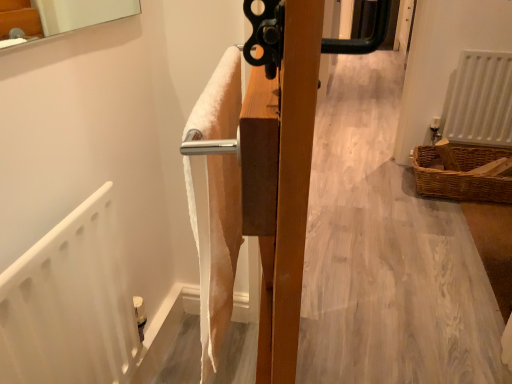
Question: Would you consider brown woven basket at lower right to be distant from white matte radiator at right?

Choices:
 (A) no
 (B) yes

Answer: (A)

Question: Can you confirm if brown woven basket at lower right is positioned to the left of white matte radiator at right?

Choices:
 (A) yes
 (B) no

Answer: (A)

Question: Considering the relative positions of brown woven basket at lower right and white matte radiator at right in the image provided, is brown woven basket at lower right behind white matte radiator at right?

Choices:
 (A) no
 (B) yes

Answer: (A)

Question: Can you confirm if brown woven basket at lower right is smaller than white matte radiator at right?

Choices:
 (A) no
 (B) yes

Answer: (A)

Question: Does brown woven basket at lower right have a lesser height compared to white matte radiator at right?

Choices:
 (A) yes
 (B) no

Answer: (A)

Question: Considering the relative positions of brown woven basket at lower right and white matte radiator at right in the image provided, is brown woven basket at lower right in front of white matte radiator at right?

Choices:
 (A) yes
 (B) no

Answer: (A)

Question: Considering the relative positions of white matte radiator at right and brown woven basket at lower right in the image provided, is white matte radiator at right to the left of brown woven basket at lower right from the viewer's perspective?

Choices:
 (A) yes
 (B) no

Answer: (B)

Question: Is white matte radiator at right to the right of brown woven basket at lower right from the viewer's perspective?

Choices:
 (A) no
 (B) yes

Answer: (B)

Question: Is the position of white matte radiator at right less distant than that of brown woven basket at lower right?

Choices:
 (A) no
 (B) yes

Answer: (A)

Question: Can we say white matte radiator at right lies outside brown woven basket at lower right?

Choices:
 (A) yes
 (B) no

Answer: (A)

Question: Considering the relative sizes of white matte radiator at right and brown woven basket at lower right in the image provided, is white matte radiator at right wider than brown woven basket at lower right?

Choices:
 (A) no
 (B) yes

Answer: (A)

Question: Considering the relative sizes of white matte radiator at right and brown woven basket at lower right in the image provided, is white matte radiator at right taller than brown woven basket at lower right?

Choices:
 (A) yes
 (B) no

Answer: (A)

Question: In terms of width, does brown woven basket at lower right look wider or thinner when compared to white matte radiator at right?

Choices:
 (A) wide
 (B) thin

Answer: (A)